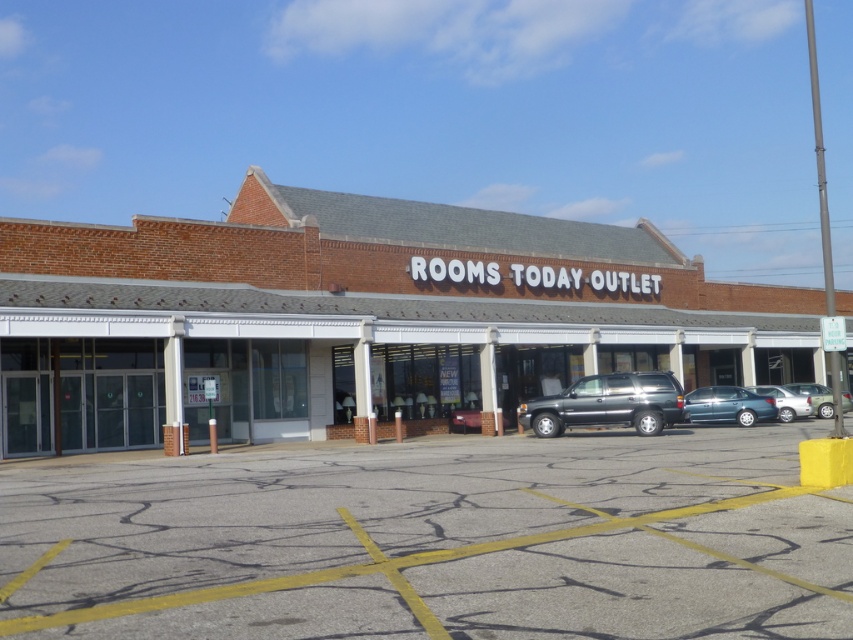
Question: Can you confirm if teal metallic sedan at center is wider than metallic silver sedan at center-right?

Choices:
 (A) yes
 (B) no

Answer: (A)

Question: Based on their relative distances, which object is farther from the smooth asphalt parking lot at center?

Choices:
 (A) teal metallic sedan at center
 (B) matte black suv at center

Answer: (A)

Question: Which object appears closest to the camera in this image?

Choices:
 (A) smooth asphalt parking lot at center
 (B) metallic silver sedan at center-right

Answer: (A)

Question: Does smooth asphalt parking lot at center lie in front of teal metallic sedan at center?

Choices:
 (A) yes
 (B) no

Answer: (A)

Question: Observing the image, what is the correct spatial positioning of brick building at center in reference to teal metallic sedan at center?

Choices:
 (A) above
 (B) below

Answer: (A)

Question: Which object appears farthest from the camera in this image?

Choices:
 (A) metallic silver sedan at center-right
 (B) teal metallic sedan at center

Answer: (A)